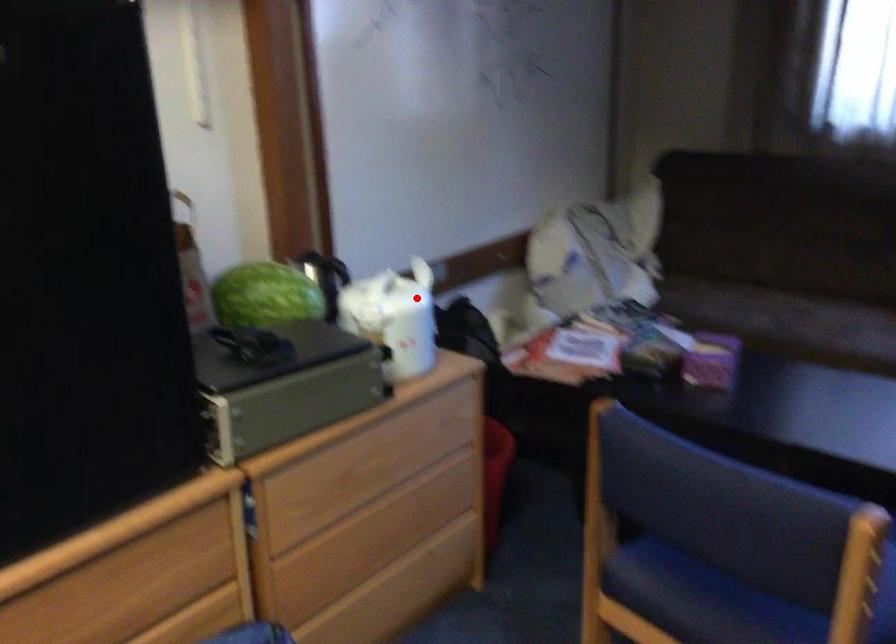
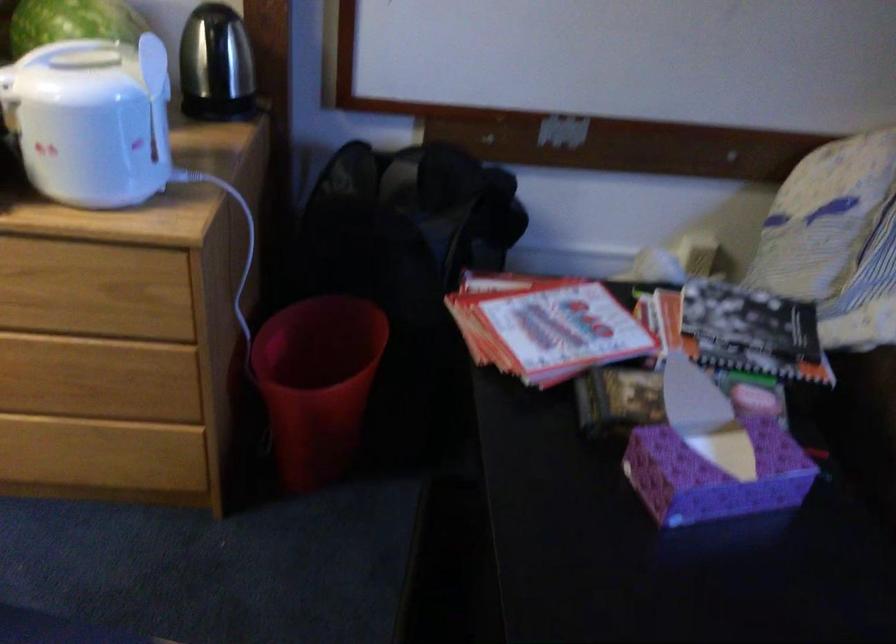
Question: I am providing you with two images of the same scene from different viewpoints. Image1 has a red point marked. In image2, the corresponding 3D location appears at what relative position? Reply with the corresponding letter.

Choices:
 (A) Closer
 (B) Farther

Answer: (A)